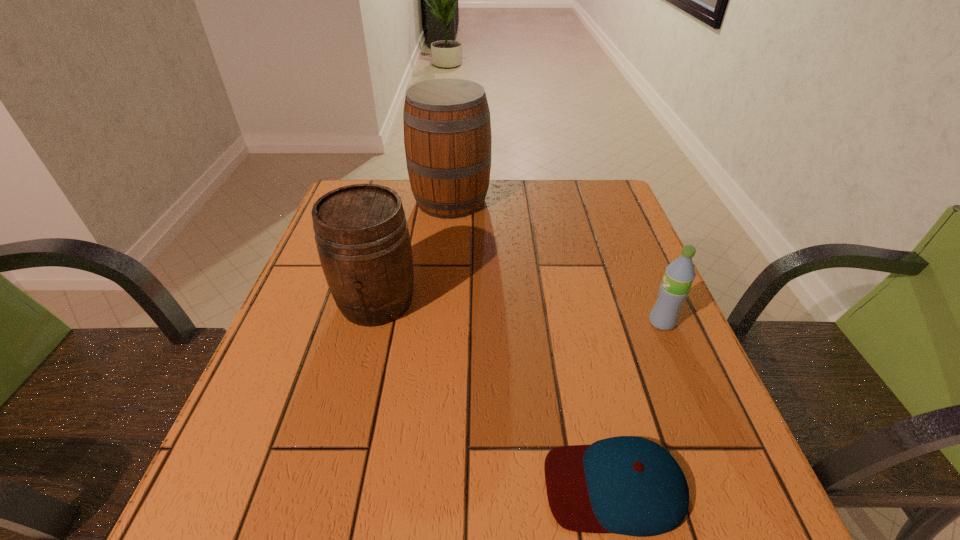
Where is `vacant space situated 0.340m on the back of the second shortest object`? Image resolution: width=960 pixels, height=540 pixels. vacant space situated 0.340m on the back of the second shortest object is located at coordinates (620, 222).

Locate an element on the screen. The width and height of the screenshot is (960, 540). vacant region located 0.130m with the bill of the nearest object facing forward is located at coordinates (458, 486).

What are the coordinates of `vacant space located 0.170m with the bill of the nearest object facing forward` in the screenshot? It's located at (432, 486).

You are a GUI agent. You are given a task and a screenshot of the screen. Output one action in this format:
    pyautogui.click(x=<x>, y=<y>)
    Task: Click on the free space located with the bill of the nearest object facing forward
    
    Given the screenshot: What is the action you would take?
    pyautogui.click(x=478, y=486)

Where is `object located at the far edge`? The width and height of the screenshot is (960, 540). object located at the far edge is located at coordinates click(x=447, y=129).

Locate an element on the screen. Image resolution: width=960 pixels, height=540 pixels. object present at the near edge is located at coordinates (628, 485).

This screenshot has height=540, width=960. I want to click on object at the left edge, so click(361, 232).

Locate an element on the screen. The image size is (960, 540). water bottle that is at the right edge is located at coordinates (679, 275).

This screenshot has height=540, width=960. What are the coordinates of `baseball cap that is at the right edge` in the screenshot? It's located at (628, 485).

Find the location of a particular element. This screenshot has width=960, height=540. object that is at the near right corner is located at coordinates (628, 485).